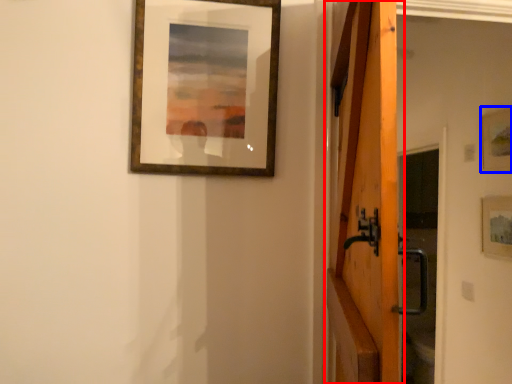
Question: Which point is further to the camera, barn door (highlighted by a red box) or picture frame (highlighted by a blue box)?

Choices:
 (A) barn door
 (B) picture frame

Answer: (B)